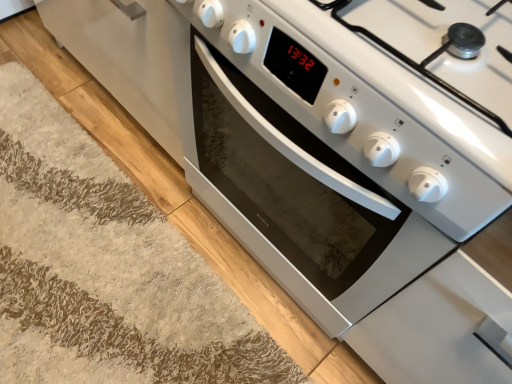
Question: Considering the relative sizes of white shaggy rug at lower left and white glossy oven at center in the image provided, is white shaggy rug at lower left taller than white glossy oven at center?

Choices:
 (A) no
 (B) yes

Answer: (A)

Question: Is white shaggy rug at lower left to the left of white glossy oven at center from the viewer's perspective?

Choices:
 (A) no
 (B) yes

Answer: (B)

Question: Is white shaggy rug at lower left outside white glossy oven at center?

Choices:
 (A) yes
 (B) no

Answer: (A)

Question: From a real-world perspective, is white shaggy rug at lower left located higher than white glossy oven at center?

Choices:
 (A) yes
 (B) no

Answer: (B)

Question: Can you confirm if white shaggy rug at lower left is shorter than white glossy oven at center?

Choices:
 (A) no
 (B) yes

Answer: (B)

Question: Does white shaggy rug at lower left have a lesser width compared to white glossy oven at center?

Choices:
 (A) yes
 (B) no

Answer: (A)

Question: Is white glossy oven at center not inside white shaggy rug at lower left?

Choices:
 (A) no
 (B) yes

Answer: (B)

Question: From the image's perspective, is white glossy oven at center over white shaggy rug at lower left?

Choices:
 (A) yes
 (B) no

Answer: (A)

Question: Does white glossy oven at center come in front of white shaggy rug at lower left?

Choices:
 (A) yes
 (B) no

Answer: (A)

Question: Would you say white glossy oven at center is a long distance from white shaggy rug at lower left?

Choices:
 (A) yes
 (B) no

Answer: (B)

Question: Is white glossy oven at center oriented towards white shaggy rug at lower left?

Choices:
 (A) no
 (B) yes

Answer: (B)

Question: Considering the relative sizes of white glossy oven at center and white shaggy rug at lower left in the image provided, is white glossy oven at center smaller than white shaggy rug at lower left?

Choices:
 (A) no
 (B) yes

Answer: (A)

Question: From a real-world perspective, is white shaggy rug at lower left above or below white glossy oven at center?

Choices:
 (A) above
 (B) below

Answer: (B)